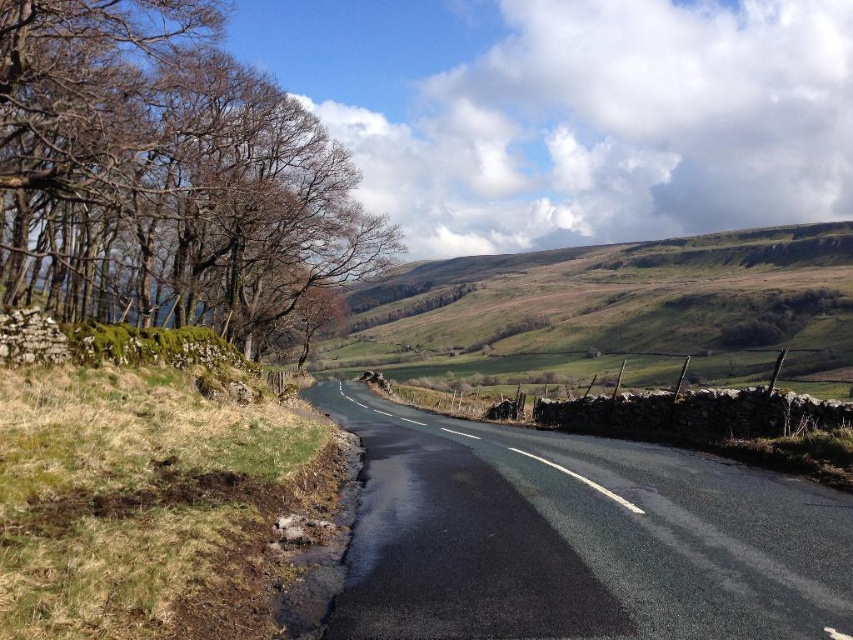
Is black asphalt road at center below green grassy hillside at upper center?

Indeed, black asphalt road at center is positioned under green grassy hillside at upper center.

In the scene shown: Does black asphalt road at center come in front of green grassy hillside at upper center?

Yes, black asphalt road at center is closer to the viewer.

Is point (438, 465) positioned in front of point (817, 262)?

Yes.

You are a GUI agent. You are given a task and a screenshot of the screen. Output one action in this format:
    pyautogui.click(x=<x>, y=<y>)
    Task: Click on the black asphalt road at center
    This screenshot has width=853, height=640.
    Given the screenshot: What is the action you would take?
    pyautogui.click(x=577, y=538)

Is point (274, 182) farther from camera compared to point (566, 499)?

Yes, point (274, 182) is farther from viewer.

Is brown bark tree at left thinner than black asphalt road at center?

No.

At what (x,y) coordinates should I click in order to perform the action: click on brown bark tree at left. Please return your answer as a coordinate pair (x, y). Looking at the image, I should click on (165, 173).

Which is in front, point (183, 64) or point (538, 262)?

Point (183, 64) is in front.

Can you confirm if brown bark tree at left is smaller than green grassy hillside at upper center?

Indeed, brown bark tree at left has a smaller size compared to green grassy hillside at upper center.

Between point (67, 132) and point (392, 358), which one is positioned in front?

Positioned in front is point (67, 132).

Where is `brown bark tree at left`? brown bark tree at left is located at coordinates (165, 173).